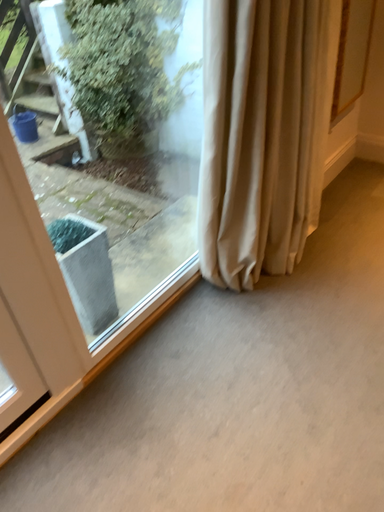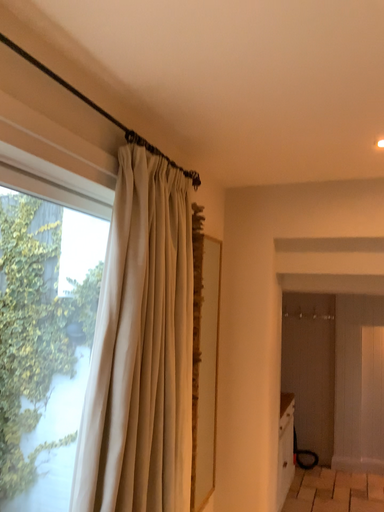
Question: How did the camera likely rotate when shooting the video?

Choices:
 (A) rotated downward
 (B) rotated upward

Answer: (B)